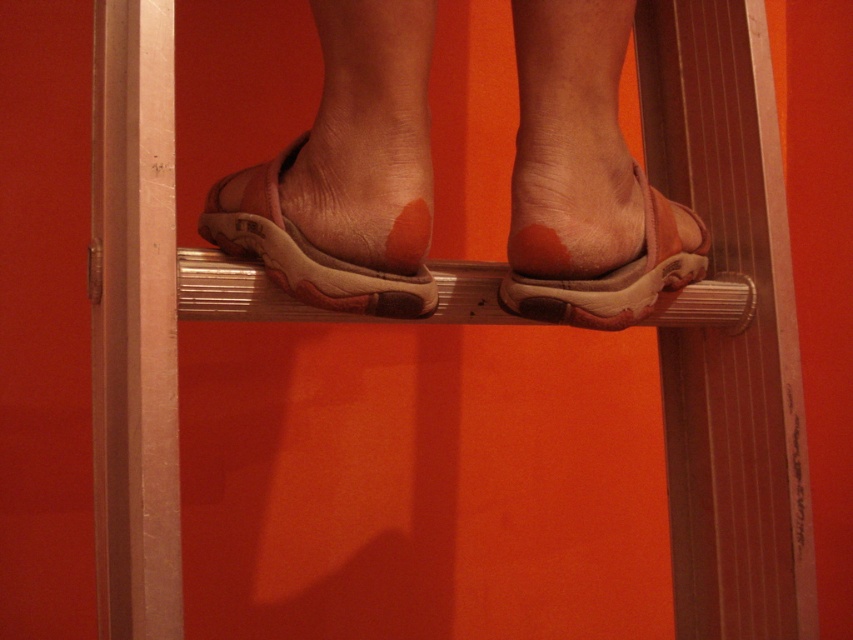
You are standing in front of a ladder leaning against an orange wall. You notice two items on the ladder steps. Which one is positioned to the right between the leather sandals at center and the leather sandal at center?

The leather sandals at center are positioned to the right of the leather sandal at center.

You are standing in front of a ladder leaning against a wall. You see a point marked at coordinates (306, 252). Where would you place your foot to step onto the ladder at that exact point?

You should place your foot on the leather sandal at center located at point (306, 252) to step onto the ladder at that exact point.